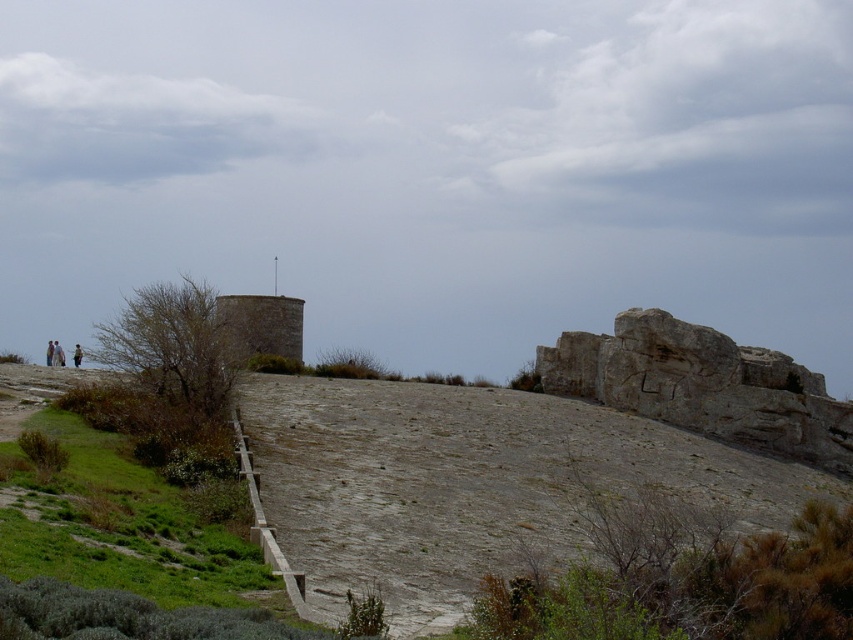
Does gray rocky hillside at center have a greater width compared to green grassy at lower left?

Yes, gray rocky hillside at center is wider than green grassy at lower left.

Can you confirm if gray rocky hillside at center is taller than green grassy at lower left?

Yes, gray rocky hillside at center is taller than green grassy at lower left.

Identify the location of gray rocky hillside at center. The width and height of the screenshot is (853, 640). (469, 484).

I want to click on gray rocky hillside at center, so click(469, 484).